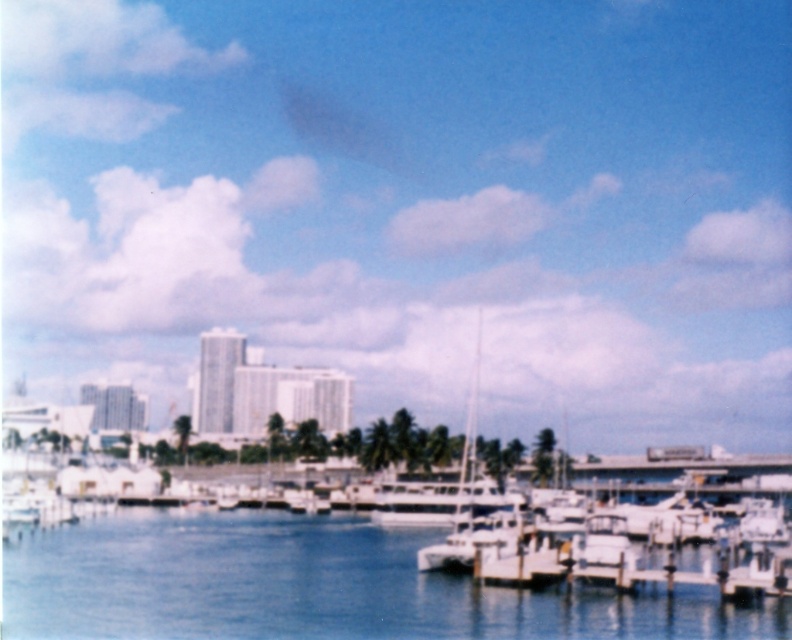
You are standing at the edge of the marina and want to take a photo of the white glossy sailboat at center. Since the clear blue water at center is in the way, will you need to adjust your camera angle to focus on the sailboat?

The clear blue water at center is closer to the viewer than the white glossy sailboat at center, so you will need to adjust your camera angle to focus on the sailboat by moving the focus point past the water.

You are a photographer positioned at the edge of the marina. You want to capture a photo where the clear blue water at center is visible to the left of the white glossy sailboat at center. Is this possible given their current positions?

Yes, because the clear blue water at center is already positioned to the left of the white glossy sailboat at center, so capturing the photo as desired is possible.

Based on the photo, you are a drone operator trying to capture the clear blue water at center from above. What are the coordinates where you should direct your drone to focus?

The clear blue water at center is located at coordinates point (311, 586), so you should direct your drone to focus there.